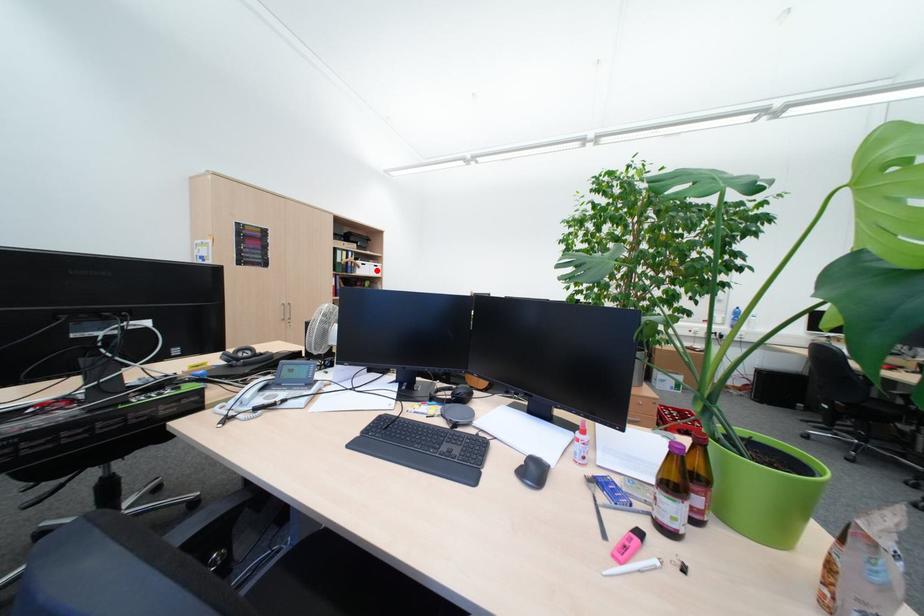
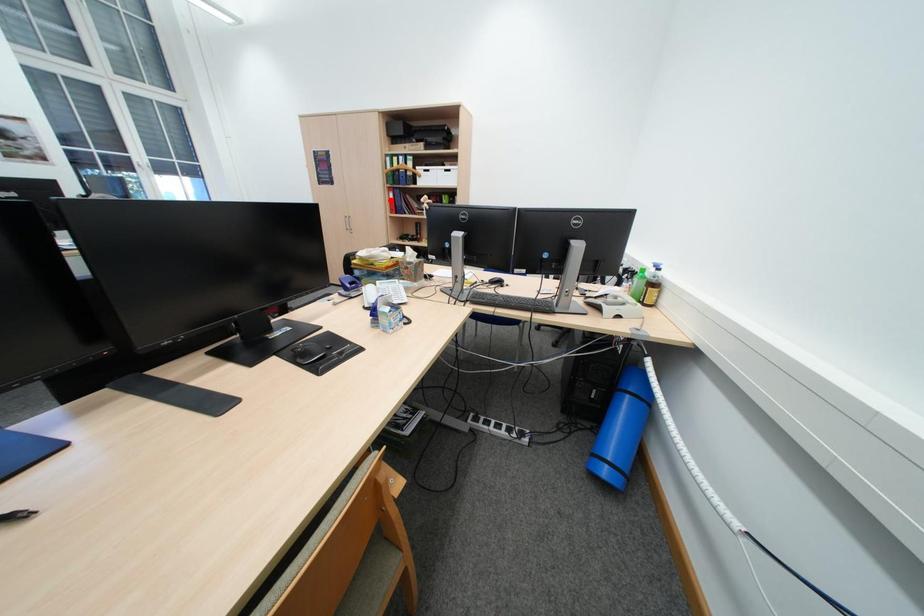
I am providing you with two images of the same scene from different viewpoints. A red point is marked on the first image and another point is marked on the second image. Does the point marked in image1 correspond to the same location as the one in image2?

No